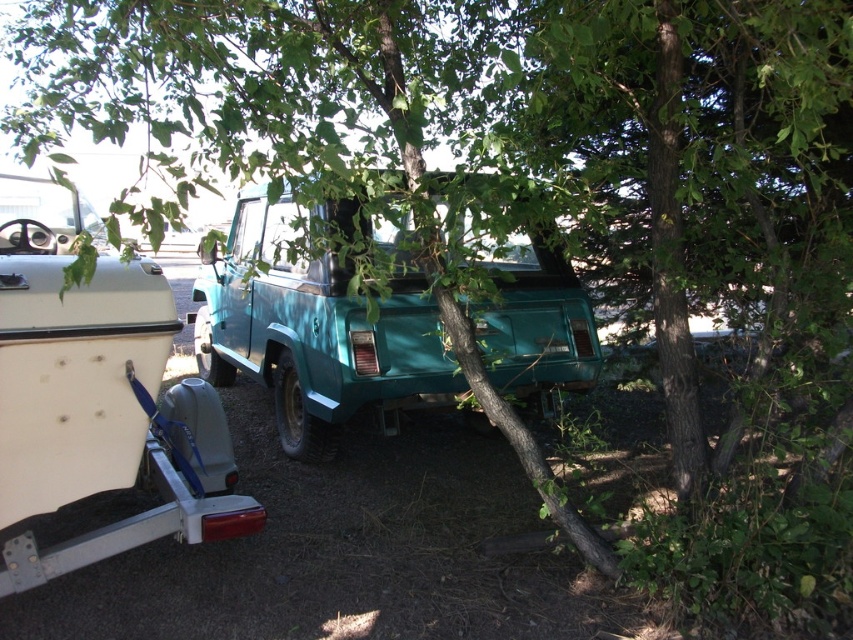
Question: Which of the following is the closest to the observer?

Choices:
 (A) pyautogui.click(x=196, y=525)
 (B) pyautogui.click(x=267, y=291)

Answer: (A)

Question: Which of the following is the closest to the observer?

Choices:
 (A) teal matte pickup truck at center
 (B) teal matte pickup truck at left

Answer: (B)

Question: Is teal matte pickup truck at left positioned before teal matte pickup truck at center?

Choices:
 (A) no
 (B) yes

Answer: (B)

Question: Does teal matte pickup truck at left appear on the left side of teal matte pickup truck at center?

Choices:
 (A) yes
 (B) no

Answer: (A)

Question: Is teal matte pickup truck at left smaller than teal matte pickup truck at center?

Choices:
 (A) yes
 (B) no

Answer: (A)